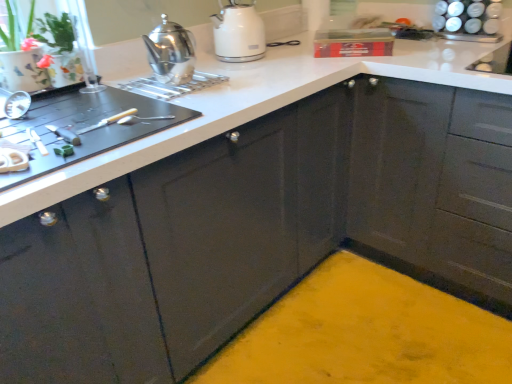
I want to click on free space in front of polished stainless steel teapot at upper left, arranged as the 2th kitchen appliance when viewed from the back, so click(162, 102).